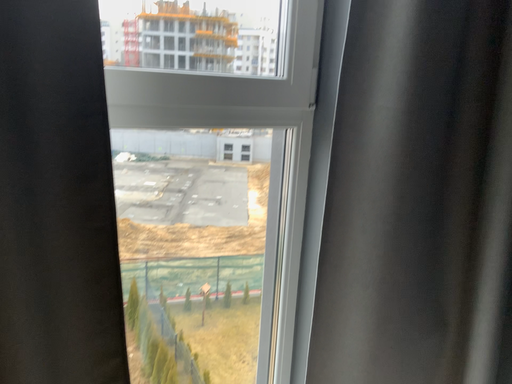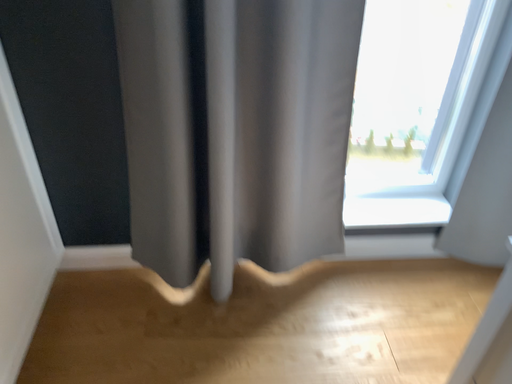
Question: Which way did the camera rotate in the video?

Choices:
 (A) rotated right
 (B) rotated left

Answer: (B)